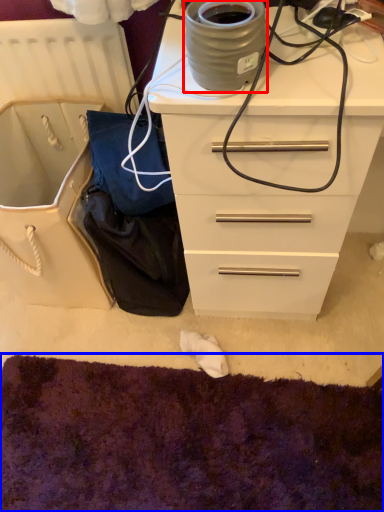
Question: Which point is further to the camera, appliance (highlighted by a red box) or cat bed (highlighted by a blue box)?

Choices:
 (A) appliance
 (B) cat bed

Answer: (B)